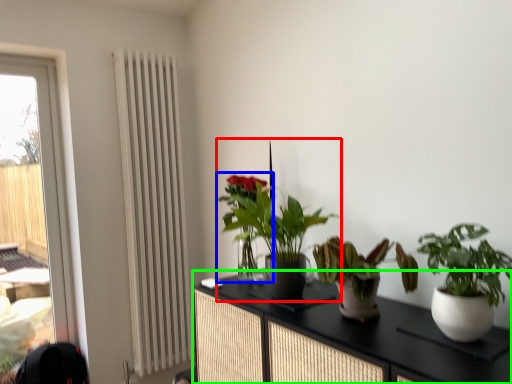
Question: Estimate the real-world distances between objects in this image. Which object is closer to houseplant (highlighted by a red box), houseplant (highlighted by a blue box) or cabinetry (highlighted by a green box)?

Choices:
 (A) houseplant
 (B) cabinetry

Answer: (A)